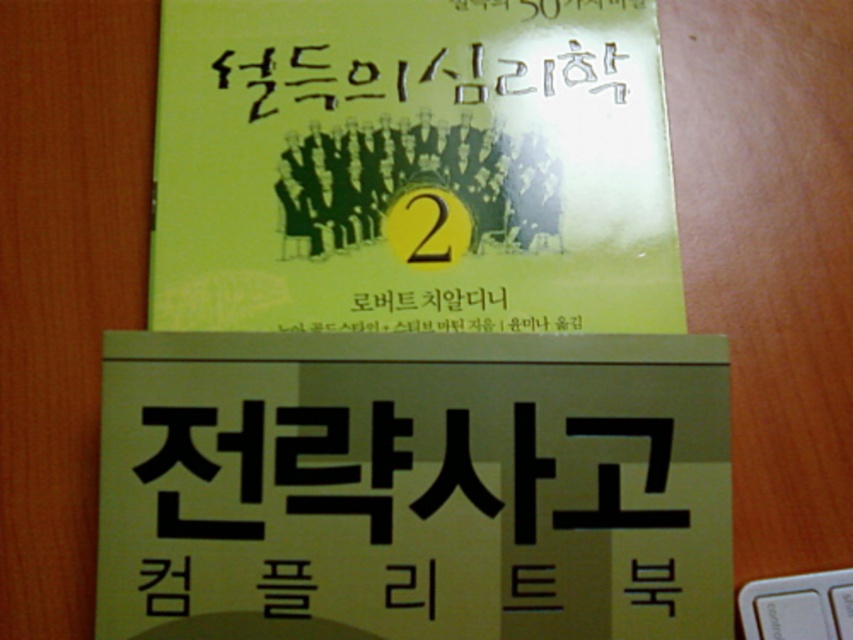
You are a photographer adjusting your camera to focus on two points on the book covers. The first point is at coordinates point (642, 340) and the second is at point (514, 138). Which point should you focus on first if you want to ensure the closest object is in focus?

Point (642, 340) is closer to the camera than point (514, 138), so you should focus on point (642, 340) first to ensure the closest object is in focus.

You are a photographer adjusting your camera to focus on two points on the book covers. The first point is at coordinates point (x=277, y=60) and the second is at point (x=750, y=621). Which point should you focus on first if you want to ensure both points are in focus?

You should focus on point (x=277, y=60) first because it is closer to the camera than point (x=750, y=621). By focusing on the closer point, the farther point may still be within the depth of field, ensuring both are in focus.

You are organizing a library shelf and need to place both the yellow paper sign at center and the green matte book at center. Since the shelf has limited space, which item should you place first to ensure both fit?

You should place the green matte book at center first because the yellow paper sign at center occupies less space. This way, there will be enough room for both items on the shelf.